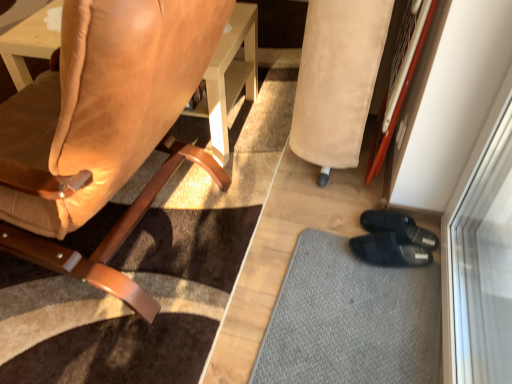
Locate an element on the screen. vacant region to the left of beige suede bean bag chair at lower right is located at coordinates (293, 177).